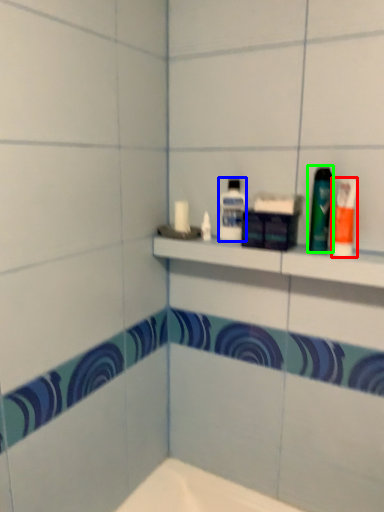
Question: Based on their relative distances, which object is nearer to toiletry (highlighted by a red box)? Choose from mouthwash (highlighted by a blue box) and mouthwash (highlighted by a green box).

Choices:
 (A) mouthwash
 (B) mouthwash

Answer: (B)